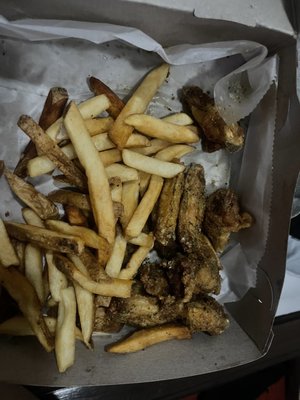
Locate an element on the screen. box is located at coordinates (238, 353).